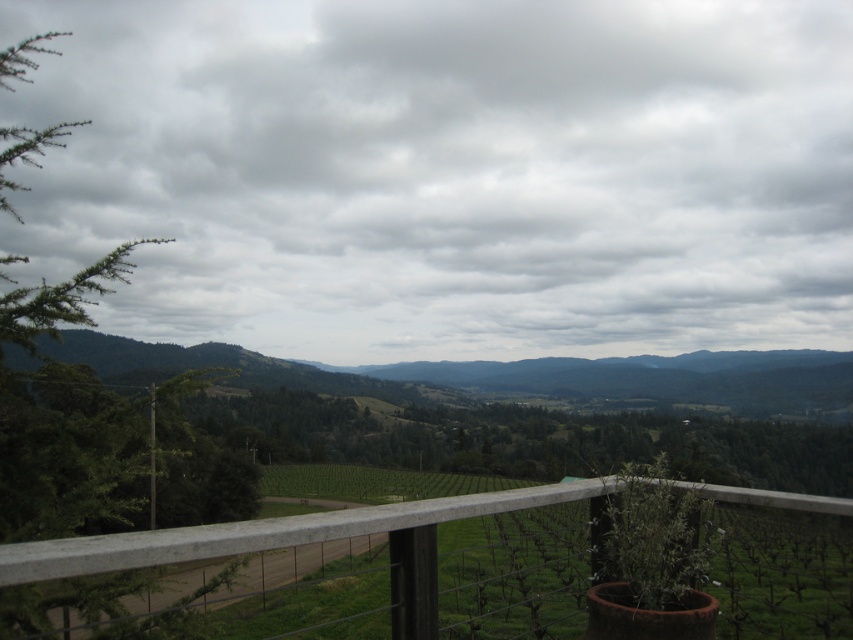
Question: Which object is farther from the camera taking this photo?

Choices:
 (A) cloudy sky at upper center
 (B) green needle-like branches at left

Answer: (A)

Question: Is cloudy sky at upper center smaller than white concrete fence at lower center?

Choices:
 (A) yes
 (B) no

Answer: (B)

Question: Which of these objects is positioned farthest from the green needle-like branches at left?

Choices:
 (A) cloudy sky at upper center
 (B) white concrete fence at lower center

Answer: (A)

Question: Is white concrete fence at lower center to the left of green needle-like branches at left from the viewer's perspective?

Choices:
 (A) no
 (B) yes

Answer: (A)

Question: Is cloudy sky at upper center positioned in front of green needle-like branches at left?

Choices:
 (A) yes
 (B) no

Answer: (B)

Question: Among these objects, which one is farthest from the camera?

Choices:
 (A) cloudy sky at upper center
 (B) green needle-like branches at left

Answer: (A)